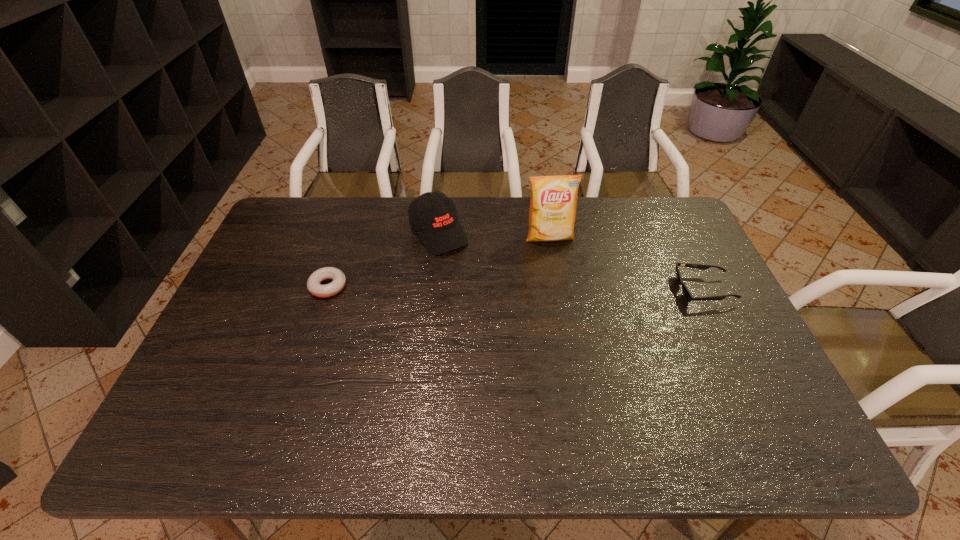
At what (x,y) coordinates should I click in order to perform the action: click on the shortest object. Please return your answer as a coordinate pair (x, y). Looking at the image, I should click on (314, 286).

Identify the location of doughnut. (314, 286).

Locate an element on the screen. the rightmost object is located at coordinates (688, 296).

The image size is (960, 540). Identify the location of the third object from right to left. (439, 229).

Find the location of a particular element. Image resolution: width=960 pixels, height=540 pixels. the second tallest object is located at coordinates (439, 229).

The image size is (960, 540). I want to click on the third object from left to right, so click(553, 204).

The image size is (960, 540). I want to click on the tallest object, so click(553, 204).

Where is `vacant space located on the back of the doughnut`? vacant space located on the back of the doughnut is located at coordinates (338, 256).

This screenshot has height=540, width=960. I want to click on vacant area situated on the front-facing side of the rightmost object, so click(x=588, y=290).

Locate an element on the screen. The image size is (960, 540). vacant space positioned on the front-facing side of the rightmost object is located at coordinates (548, 290).